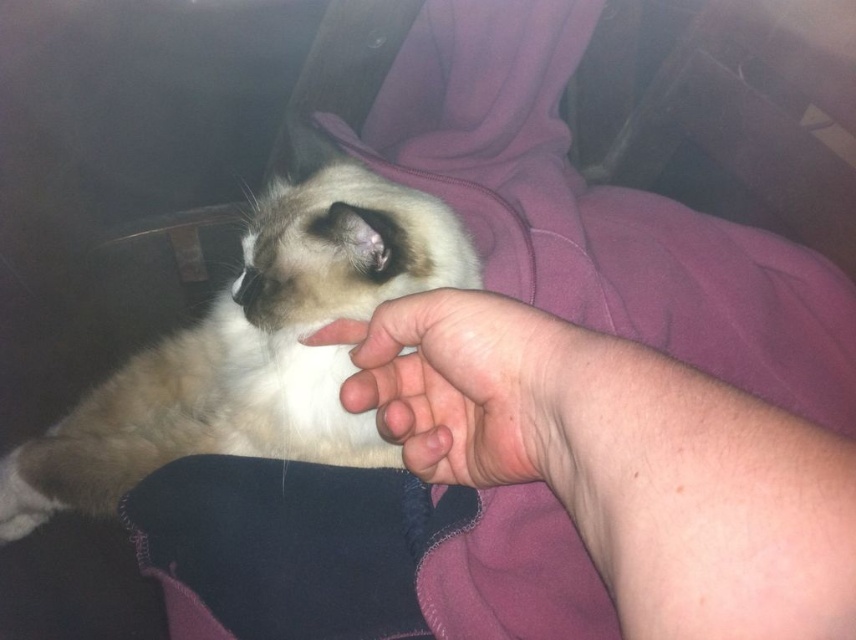
Does skinny flesh at center appear under pink flesh-toned hand at center?

Correct, skinny flesh at center is located below pink flesh-toned hand at center.

Which is above, skinny flesh at center or pink flesh-toned hand at center?

Positioned higher is pink flesh-toned hand at center.

The width and height of the screenshot is (856, 640). In order to click on skinny flesh at center in this screenshot , I will do `click(622, 461)`.

Locate an element on the screen. skinny flesh at center is located at coordinates (622, 461).

Who is more distant from viewer, (214,355) or (396,419)?

Positioned behind is point (214,355).

Is soft cream fur cat at center to the right of pink flesh-toned hand at center from the viewer's perspective?

Incorrect, soft cream fur cat at center is not on the right side of pink flesh-toned hand at center.

Measure the distance between point [299,244] and camera.

Point [299,244] is 28.84 inches away from camera.

Locate an element on the screen. The height and width of the screenshot is (640, 856). soft cream fur cat at center is located at coordinates (253, 349).

Does skinny flesh at center come in front of soft cream fur cat at center?

Yes, skinny flesh at center is in front of soft cream fur cat at center.

Measure the distance from skinny flesh at center to soft cream fur cat at center.

skinny flesh at center and soft cream fur cat at center are 8.52 inches apart from each other.

The width and height of the screenshot is (856, 640). What do you see at coordinates (622, 461) in the screenshot? I see `skinny flesh at center` at bounding box center [622, 461].

This screenshot has width=856, height=640. Find the location of `skinny flesh at center`. skinny flesh at center is located at coordinates (622, 461).